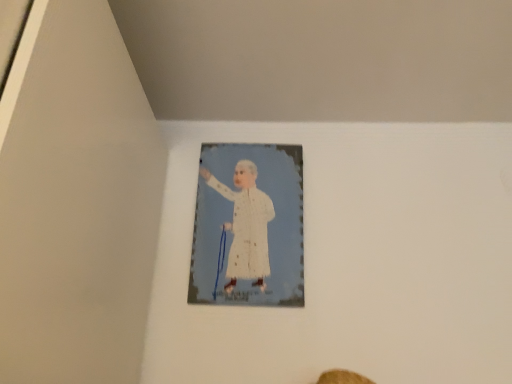
Describe the element at coordinates (246, 225) in the screenshot. I see `white textured fabric at upper center` at that location.

You are a GUI agent. You are given a task and a screenshot of the screen. Output one action in this format:
    pyautogui.click(x=<x>, y=<y>)
    Task: Click on the white textured fabric at upper center
    Image resolution: width=512 pixels, height=384 pixels.
    Given the screenshot: What is the action you would take?
    pyautogui.click(x=246, y=225)

Where is `white textured fabric at upper center`? white textured fabric at upper center is located at coordinates (246, 225).